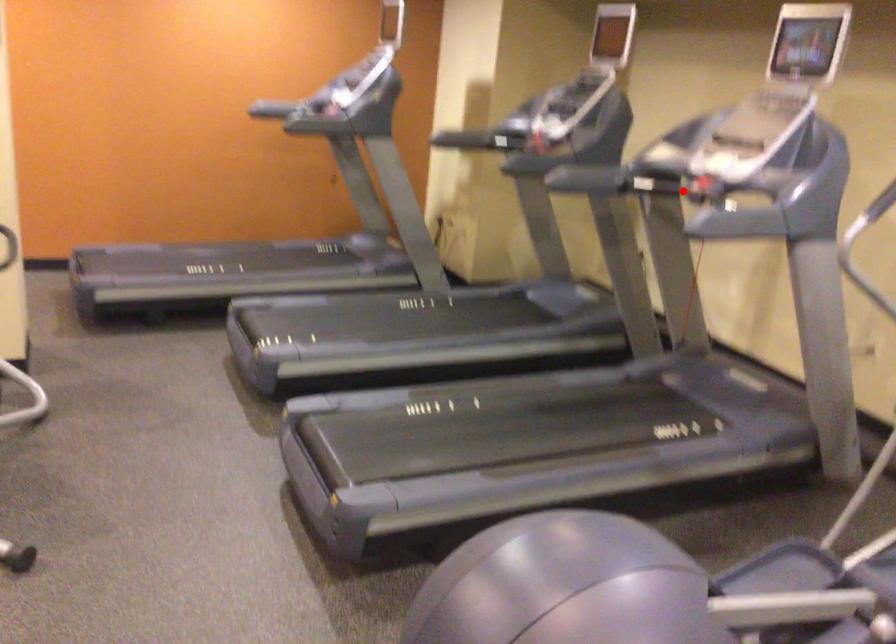
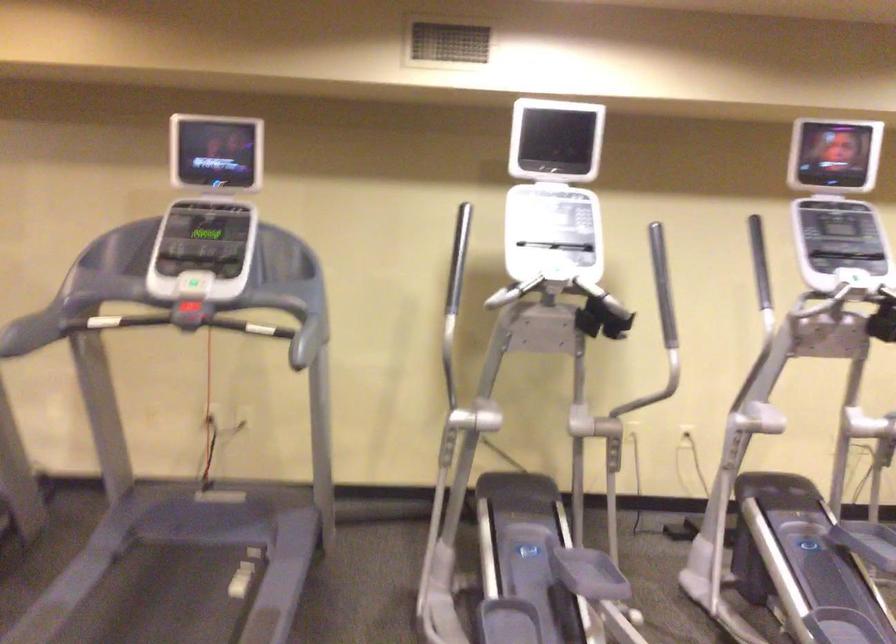
Question: I am providing you with two images of the same scene from different viewpoints. In image1, a red point is highlighted. Considering the same 3D point in image2, which of the following is correct?

Choices:
 (A) It is closer
 (B) It is farther

Answer: (A)